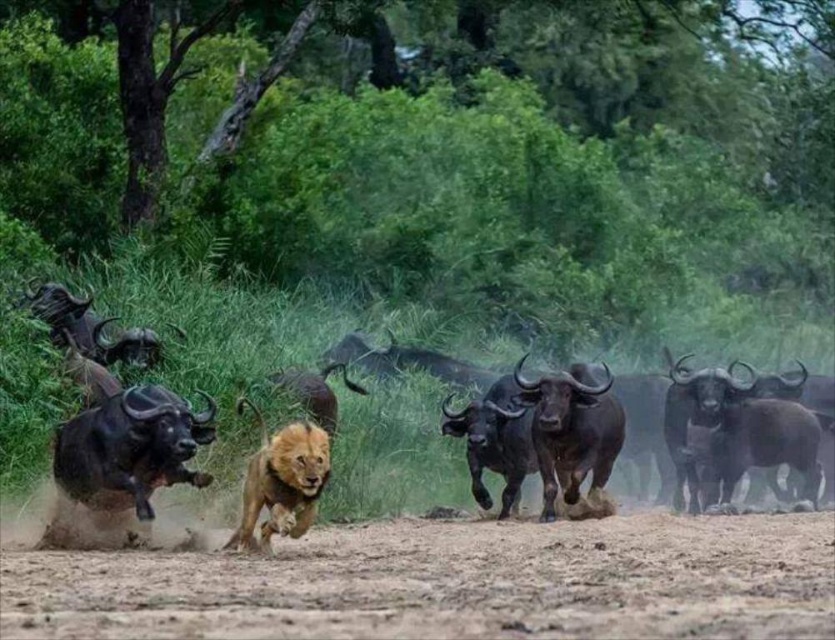
Question: Which point is closer to the camera?

Choices:
 (A) (226, 385)
 (B) (289, 426)
 (C) (152, 426)
 (D) (596, 556)

Answer: (D)

Question: Can you confirm if brown rough horned yak at left is positioned to the left of golden fur lion at center?

Choices:
 (A) yes
 (B) no

Answer: (A)

Question: Is the position of black glossy buffalo at center less distant than that of brown rough horned yak at left?

Choices:
 (A) no
 (B) yes

Answer: (B)

Question: Which is nearer to the black glossy buffalo at center?

Choices:
 (A) brown dusty ground at center
 (B) brown rough horned yak at left

Answer: (B)

Question: Estimate the real-world distances between objects in this image. Which object is farther from the black glossy buffalo at center?

Choices:
 (A) golden fur lion at center
 (B) brown dusty ground at center

Answer: (B)

Question: Does brown dusty ground at center appear on the left side of black glossy buffalo at center?

Choices:
 (A) no
 (B) yes

Answer: (A)